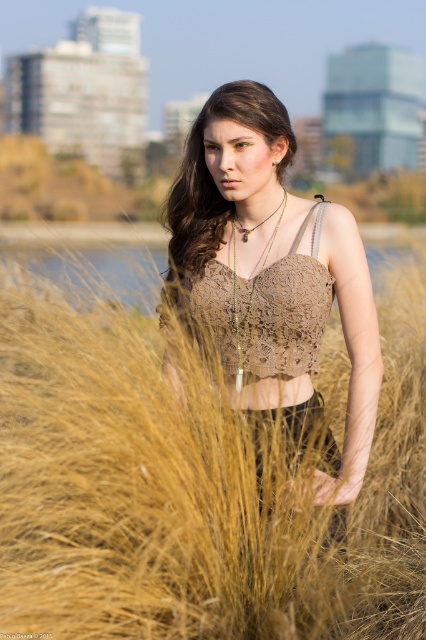
You are a fashion designer observing the image and need to determine the distance between the two tops. Given that the minimum distance required to distinguish two similar items in a catalog is 3 inches, can the brown lace crop top at center and the lace fabric bikini top at center be clearly differentiated in the catalog photo?

The brown lace crop top at center is 2.96 inches from the lace fabric bikini top at center. Since the minimum required distance is 3 inches, the two tops cannot be clearly differentiated in the catalog photo as they are slightly closer than the required distance.

You are a fashion designer observing the image and want to create a new outfit. You notice two tops at the center of the image. Which top has a wider design between the brown lace crop top at center and the lace fabric bikini top at center?

The brown lace crop top at center is wider than the lace fabric bikini top at center according to the description.